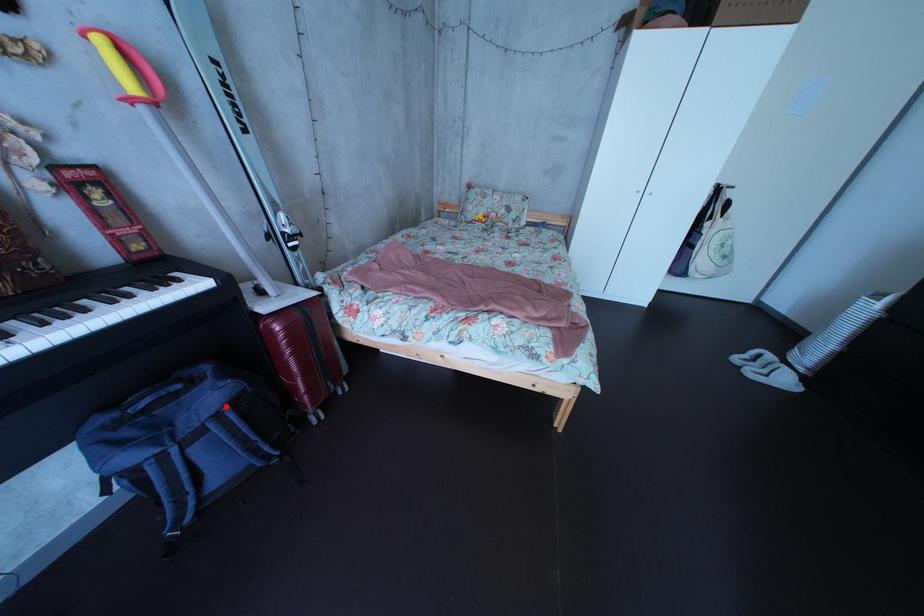
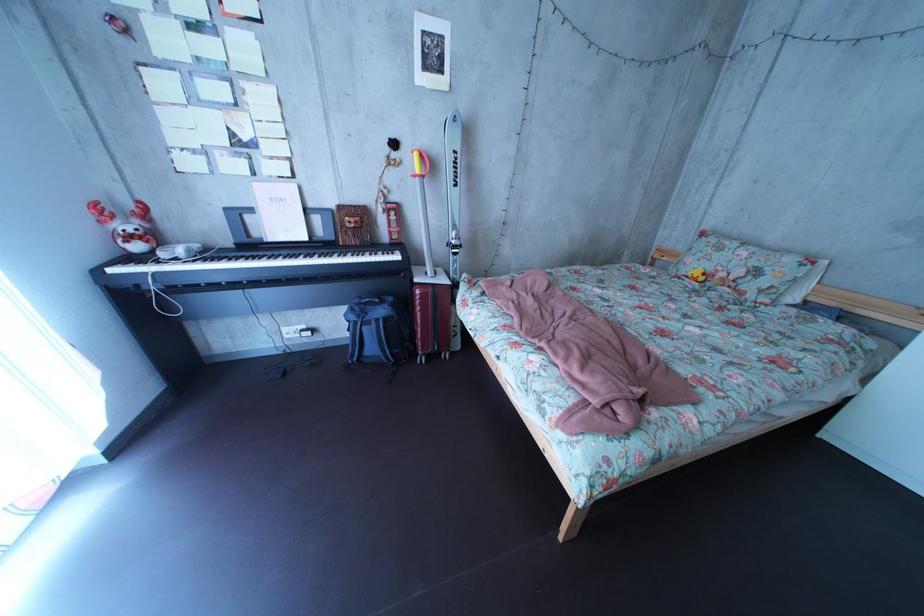
Where in the second image is the point corresponding to the highlighted location from the first image?

(395, 320)